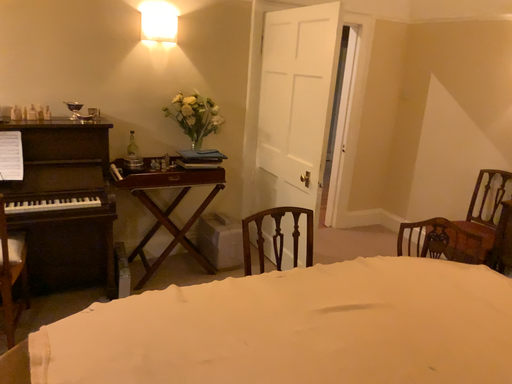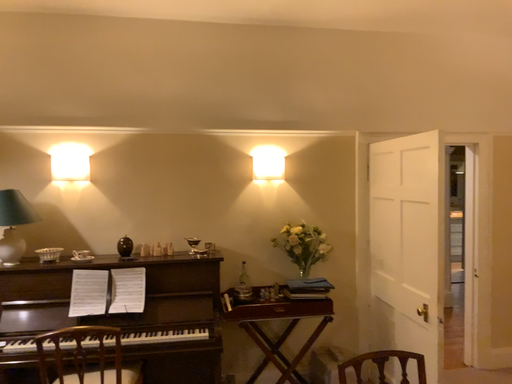
Question: Which way did the camera rotate in the video?

Choices:
 (A) rotated downward
 (B) rotated upward

Answer: (B)